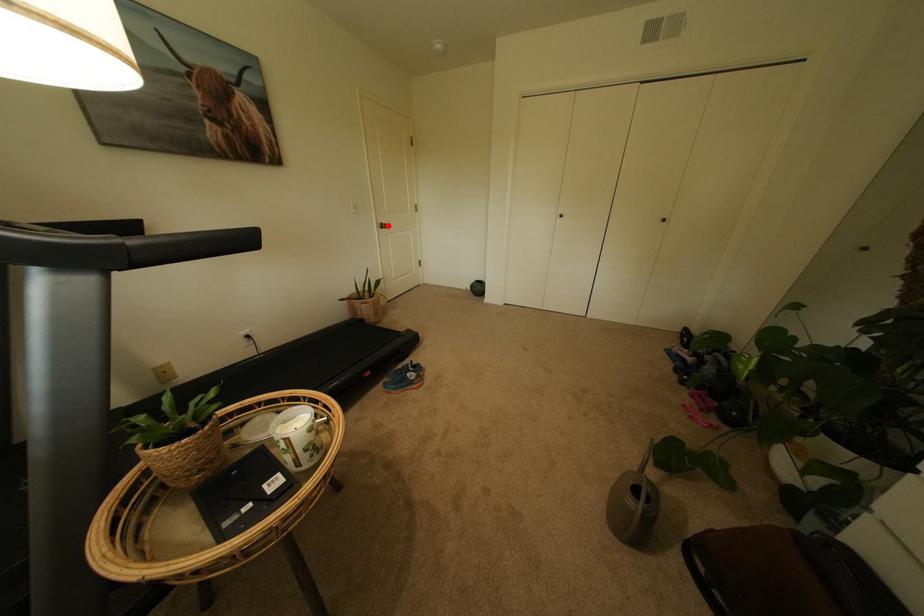
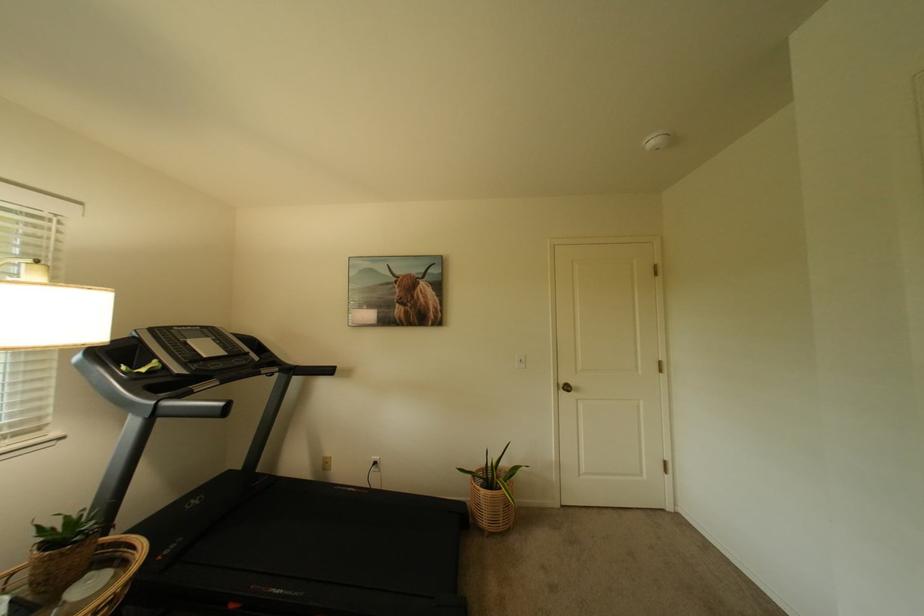
In the second image, find the point that corresponds to the highlighted location in the first image.

(569, 386)